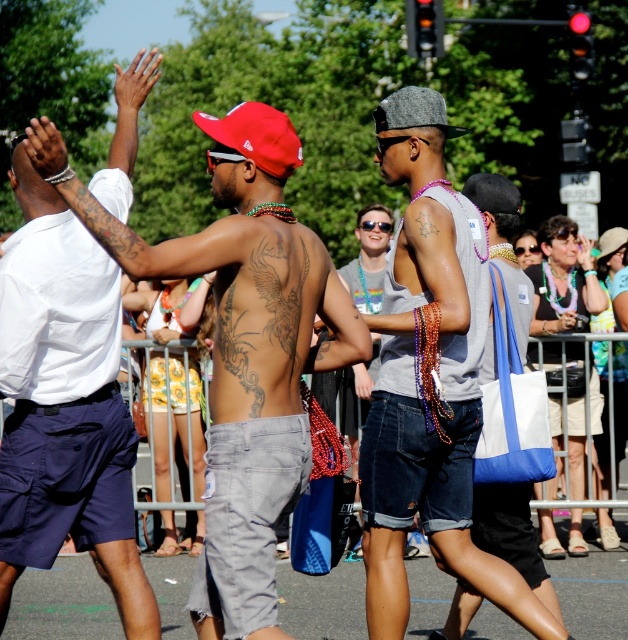
Question: Estimate the real-world distances between objects in this image. Which object is closer to the denim shorts at center?

Choices:
 (A) white cotton shirt at upper left
 (B) brown tattooed back at center
 (C) shiny metallic tank top at center
 (D) gray felt baseball cap at center

Answer: (C)

Question: Is denim shorts at center to the right of white cotton shirt at upper left from the viewer's perspective?

Choices:
 (A) yes
 (B) no

Answer: (A)

Question: Which object is the farthest from the white cotton shirt at upper left?

Choices:
 (A) brown tattooed back at center
 (B) gray felt baseball cap at center
 (C) denim shorts at center

Answer: (B)

Question: Among these points, which one is farthest from the camera?

Choices:
 (A) (306, 284)
 (B) (256, 301)
 (C) (126, 104)
 (D) (391, 312)

Answer: (C)

Question: Does denim shorts at center have a larger size compared to white cotton shirt at upper left?

Choices:
 (A) no
 (B) yes

Answer: (B)

Question: Where is white cotton shirt at upper left located in relation to gray felt baseball cap at center in the image?

Choices:
 (A) right
 (B) left

Answer: (B)